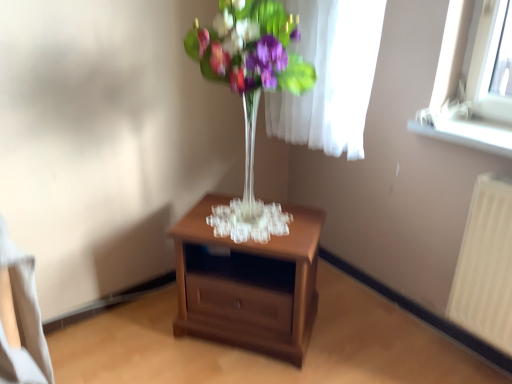
Locate an element on the screen. vacant area located to the right-hand side of brown wooden nightstand at center is located at coordinates (353, 326).